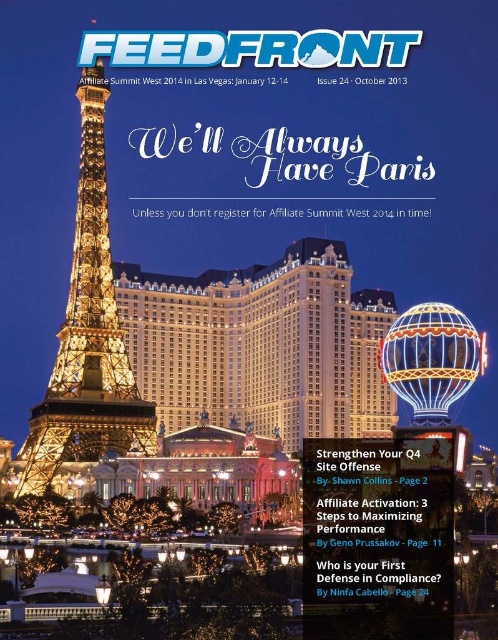
Question: Is illuminated glass hotel at center wider than illuminated steel eiffel tower at left?

Choices:
 (A) no
 (B) yes

Answer: (B)

Question: Considering the relative positions of illuminated glass hotel at center and illuminated steel eiffel tower at left in the image provided, where is illuminated glass hotel at center located with respect to illuminated steel eiffel tower at left?

Choices:
 (A) left
 (B) right

Answer: (B)

Question: Is illuminated glass hotel at center to the right of illuminated steel eiffel tower at left from the viewer's perspective?

Choices:
 (A) no
 (B) yes

Answer: (B)

Question: Which object appears closest to the camera in this image?

Choices:
 (A) illuminated steel eiffel tower at left
 (B) illuminated glass hotel at center

Answer: (A)